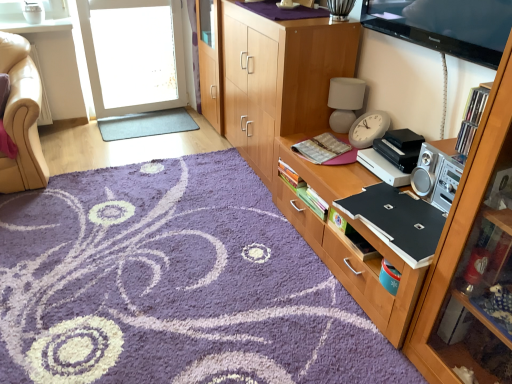
This screenshot has width=512, height=384. Identify the location of clear plastic cds at upper right. (471, 118).

The image size is (512, 384). Find the location of `gray rubber mat at center, placed as the second plain when sorted from bottom to top`. gray rubber mat at center, placed as the second plain when sorted from bottom to top is located at coordinates (146, 124).

Describe the element at coordinates (397, 221) in the screenshot. I see `black matte laptop at right` at that location.

You are a GUI agent. You are given a task and a screenshot of the screen. Output one action in this format:
    pyautogui.click(x=<x>, y=<y>)
    Task: Click on the wooden cabinet at right, the third cabinetry positioned from the back
    The width and height of the screenshot is (512, 384).
    Given the screenshot: What is the action you would take?
    pyautogui.click(x=473, y=261)

Which object is further away from the camera, transparent plastic screen door at upper left or gray rubber mat at center, which ranks as the second plain in front-to-back order?

Positioned behind is gray rubber mat at center, which ranks as the second plain in front-to-back order.

From a real-world perspective, is transparent plastic screen door at upper left physically above gray rubber mat at center, the 1th plain in the top-to-bottom sequence?

Correct, in the physical world, transparent plastic screen door at upper left is higher than gray rubber mat at center, the 1th plain in the top-to-bottom sequence.

Is transparent plastic screen door at upper left bigger than gray rubber mat at center, which ranks as the second plain in front-to-back order?

Indeed, transparent plastic screen door at upper left has a larger size compared to gray rubber mat at center, which ranks as the second plain in front-to-back order.

Is matte gray speaker at upper right to the left of transparent plastic screen door at upper left from the viewer's perspective?

No.

Which of these two, matte gray speaker at upper right or transparent plastic screen door at upper left, stands taller?

With more height is transparent plastic screen door at upper left.

Is matte gray speaker at upper right wider than transparent plastic screen door at upper left?

In fact, matte gray speaker at upper right might be narrower than transparent plastic screen door at upper left.

In order to click on screen door located behind the wooden cabinet at right, arranged as the 1th cabinetry when viewed from the front in this screenshot , I will do `click(133, 54)`.

Is transparent plastic screen door at upper left facing towards wooden cabinet at right, the third cabinetry positioned from the back?

Yes, transparent plastic screen door at upper left is oriented towards wooden cabinet at right, the third cabinetry positioned from the back.

Does transparent plastic screen door at upper left appear on the right side of wooden cabinet at right, arranged as the 1th cabinetry when viewed from the front?

No, transparent plastic screen door at upper left is not to the right of wooden cabinet at right, arranged as the 1th cabinetry when viewed from the front.

From a real-world perspective, does transparent plastic screen door at upper left stand above wooden cabinet at right, the third cabinetry positioned from the back?

No, from a real-world perspective, transparent plastic screen door at upper left is not over wooden cabinet at right, the third cabinetry positioned from the back

Which object is wider, wooden cabinet at center, the third cabinetry from the front, or clear plastic cds at upper right?

With larger width is wooden cabinet at center, the third cabinetry from the front.

From a real-world perspective, who is located higher, wooden cabinet at center, arranged as the 1th cabinetry when viewed from the back, or clear plastic cds at upper right?

In real-world perspective, clear plastic cds at upper right is above.

From the image's perspective, is wooden cabinet at center, the third cabinetry from the front, positioned above or below clear plastic cds at upper right?

Based on their image positions, wooden cabinet at center, the third cabinetry from the front, is located above clear plastic cds at upper right.

Does wooden cabinet at center, the third cabinetry from the front, have a larger size compared to clear plastic cds at upper right?

Correct, wooden cabinet at center, the third cabinetry from the front, is larger in size than clear plastic cds at upper right.

Which is in front, point (455, 329) or point (205, 203)?

The point (455, 329) is in front.

Is wooden cabinet at right, arranged as the 1th cabinetry when viewed from the front, thinner than purple shaggy rug at center, the 2th plain positioned from the back?

Yes, wooden cabinet at right, arranged as the 1th cabinetry when viewed from the front, is thinner than purple shaggy rug at center, the 2th plain positioned from the back.

Is wooden cabinet at right, arranged as the 1th cabinetry when viewed from the front, positioned beyond the bounds of purple shaggy rug at center, which is counted as the first plain, starting from the front?

Indeed, wooden cabinet at right, arranged as the 1th cabinetry when viewed from the front, is completely outside purple shaggy rug at center, which is counted as the first plain, starting from the front.

From the image's perspective, is wooden cabinet at right, arranged as the 1th cabinetry when viewed from the front, located above or below purple shaggy rug at center, positioned as the 1th plain in bottom-to-top order?

wooden cabinet at right, arranged as the 1th cabinetry when viewed from the front, is situated higher than purple shaggy rug at center, positioned as the 1th plain in bottom-to-top order, in the image.

What are the coordinates of `shelf above the purple shaggy rug at center, the 2th plain positioned from the back (from the image's perspective)` in the screenshot? It's located at (471, 118).

Between clear plastic cds at upper right and purple shaggy rug at center, which is counted as the first plain, starting from the front, which one is positioned in front?

purple shaggy rug at center, which is counted as the first plain, starting from the front.

Measure the distance from clear plastic cds at upper right to purple shaggy rug at center, the 2th plain positioned from the back.

The distance of clear plastic cds at upper right from purple shaggy rug at center, the 2th plain positioned from the back, is 1.35 meters.

Is purple shaggy rug at center, which is counted as the first plain, starting from the front, completely or partially inside clear plastic cds at upper right?

No, clear plastic cds at upper right does not contain purple shaggy rug at center, which is counted as the first plain, starting from the front.

Could you measure the distance between wooden cabinet at center, which ranks as the second cabinetry in front-to-back order, and wooden cabinet at center, arranged as the 1th cabinetry when viewed from the back?

21.70 inches.

Is wooden cabinet at center, which ranks as the second cabinetry in front-to-back order, wider or thinner than wooden cabinet at center, the third cabinetry from the front?

Considering their sizes, wooden cabinet at center, which ranks as the second cabinetry in front-to-back order, looks broader than wooden cabinet at center, the third cabinetry from the front.

Is wooden cabinet at center, which is counted as the 2th cabinetry, starting from the back, to the left or to the right of wooden cabinet at center, arranged as the 1th cabinetry when viewed from the back, in the image?

Clearly, wooden cabinet at center, which is counted as the 2th cabinetry, starting from the back, is on the right of wooden cabinet at center, arranged as the 1th cabinetry when viewed from the back, in the image.

From the image's perspective, is wooden cabinet at center, which is counted as the 2th cabinetry, starting from the back, on wooden cabinet at center, the third cabinetry from the front?

Actually, wooden cabinet at center, which is counted as the 2th cabinetry, starting from the back, appears below wooden cabinet at center, the third cabinetry from the front, in the image.

Where is `screen door above the gray rubber mat at center, the 1th plain from the back (from the image's perspective)`? The height and width of the screenshot is (384, 512). screen door above the gray rubber mat at center, the 1th plain from the back (from the image's perspective) is located at coordinates (133, 54).

In order to click on screen door located underneath the matte gray speaker at upper right (from a real-world perspective) in this screenshot , I will do point(133,54).

Consider the image. Considering their positions, is matte gray speaker at upper right positioned further to transparent plastic screen door at upper left than black matte laptop at right?

Based on the image, black matte laptop at right appears to be further to transparent plastic screen door at upper left.

Looking at the image, which one is located closer to black matte laptop at right, purple shaggy rug at center, the 2th plain positioned from the back, or transparent plastic screen door at upper left?

purple shaggy rug at center, the 2th plain positioned from the back, is positioned closer to the anchor black matte laptop at right.

Looking at the image, which one is located closer to wooden cabinet at center, which ranks as the second cabinetry in front-to-back order, wooden cabinet at right, the third cabinetry positioned from the back, or purple shaggy rug at center, which is counted as the first plain, starting from the front?

wooden cabinet at right, the third cabinetry positioned from the back, lies closer to wooden cabinet at center, which ranks as the second cabinetry in front-to-back order, than the other object.

When comparing their distances from wooden cabinet at center, which ranks as the second cabinetry in front-to-back order, does wooden cabinet at right, arranged as the 1th cabinetry when viewed from the front, or clear plastic cds at upper right seem closer?

wooden cabinet at right, arranged as the 1th cabinetry when viewed from the front, is closer to wooden cabinet at center, which ranks as the second cabinetry in front-to-back order.

Considering their positions, is wooden cabinet at center, the third cabinetry from the front, positioned closer to matte gray speaker at upper right than black matte laptop at right?

Result: wooden cabinet at center, the third cabinetry from the front, lies closer to matte gray speaker at upper right than the other object.

Considering their positions, is clear plastic cds at upper right positioned further to transparent plastic screen door at upper left than wooden cabinet at right, the third cabinetry positioned from the back?

The object further to transparent plastic screen door at upper left is wooden cabinet at right, the third cabinetry positioned from the back.

When comparing their distances from purple shaggy rug at center, which is counted as the second plain, starting from the top, does gray rubber mat at center, the 1th plain in the top-to-bottom sequence, or wooden cabinet at center, arranged as the 1th cabinetry when viewed from the back, seem further?

gray rubber mat at center, the 1th plain in the top-to-bottom sequence, is further to purple shaggy rug at center, which is counted as the second plain, starting from the top.

Looking at the image, which one is located closer to wooden cabinet at center, arranged as the 1th cabinetry when viewed from the back, wooden cabinet at right, the third cabinetry positioned from the back, or gray rubber mat at center, which ranks as the second plain in front-to-back order?

gray rubber mat at center, which ranks as the second plain in front-to-back order, is closer to wooden cabinet at center, arranged as the 1th cabinetry when viewed from the back.

At what (x,y) coordinates should I click in order to perform the action: click on shelf between wooden cabinet at right, the third cabinetry positioned from the back, and transparent plastic screen door at upper left from front to back. Please return your answer as a coordinate pair (x, y). The image size is (512, 384). Looking at the image, I should click on (471, 118).

Locate an element on the screen. The width and height of the screenshot is (512, 384). speaker positioned between purple shaggy rug at center, which is counted as the first plain, starting from the front, and transparent plastic screen door at upper left from near to far is located at coordinates (345, 102).

Where is `speaker located between transparent plastic screen door at upper left and wooden cabinet at center, which ranks as the second cabinetry in front-to-back order, in the left-right direction`? This screenshot has width=512, height=384. speaker located between transparent plastic screen door at upper left and wooden cabinet at center, which ranks as the second cabinetry in front-to-back order, in the left-right direction is located at coordinates (345, 102).

You are a GUI agent. You are given a task and a screenshot of the screen. Output one action in this format:
    pyautogui.click(x=<x>, y=<y>)
    Task: Click on the cabinetry between transparent plastic screen door at upper left and wooden cabinet at center, which ranks as the second cabinetry in front-to-back order
    
    Given the screenshot: What is the action you would take?
    pyautogui.click(x=279, y=78)